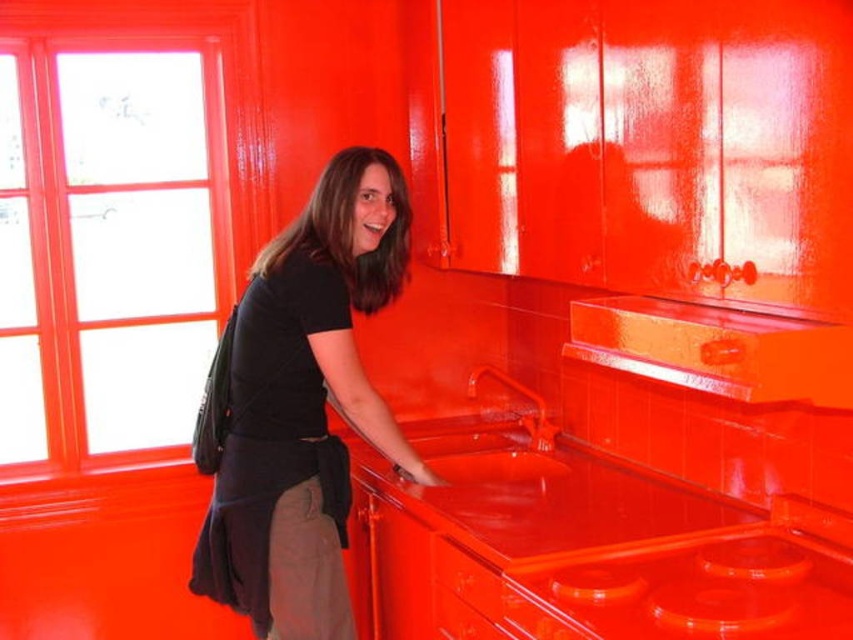
You are a GUI agent. You are given a task and a screenshot of the screen. Output one action in this format:
    pyautogui.click(x=<x>, y=<y>)
    Task: Click on the glossy orange countertop at lower center
    This screenshot has width=853, height=640.
    Given the screenshot: What is the action you would take?
    pyautogui.click(x=576, y=548)

In order to click on glossy orange countertop at lower center in this screenshot , I will do `click(576, 548)`.

The height and width of the screenshot is (640, 853). Find the location of `glossy orange countertop at lower center`. glossy orange countertop at lower center is located at coordinates (576, 548).